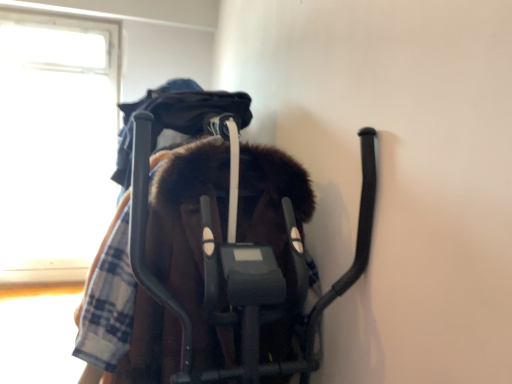
Measure the distance between point (217, 185) and camera.

The depth of point (217, 185) is 1.26 meters.

This screenshot has height=384, width=512. What do you see at coordinates (191, 241) in the screenshot? I see `brown fuzzy coat at center` at bounding box center [191, 241].

Image resolution: width=512 pixels, height=384 pixels. I want to click on brown fuzzy coat at center, so click(x=191, y=241).

Measure the distance between brown fuzzy coat at center and camera.

A distance of 1.09 meters exists between brown fuzzy coat at center and camera.

What do you see at coordinates (55, 142) in the screenshot?
I see `transparent glass window at upper left` at bounding box center [55, 142].

Identify the location of transparent glass window at upper left. (55, 142).

The height and width of the screenshot is (384, 512). In order to click on brown fuzzy coat at center in this screenshot , I will do `click(191, 241)`.

Between transparent glass window at upper left and brown fuzzy coat at center, which one appears on the left side from the viewer's perspective?

transparent glass window at upper left is more to the left.

Which object is closer to the camera, transparent glass window at upper left or brown fuzzy coat at center?

Positioned in front is brown fuzzy coat at center.

Does point (38, 237) appear closer or farther from the camera than point (167, 379)?

Point (38, 237) appears to be farther away from the viewer than point (167, 379).

From the image's perspective, which is above, transparent glass window at upper left or brown fuzzy coat at center?

transparent glass window at upper left, from the image's perspective.

From a real-world perspective, is transparent glass window at upper left positioned above or below brown fuzzy coat at center?

In terms of real-world spatial position, transparent glass window at upper left is above brown fuzzy coat at center.

Based on the photo, does transparent glass window at upper left have a greater width compared to brown fuzzy coat at center?

No.

Can you confirm if transparent glass window at upper left is shorter than brown fuzzy coat at center?

Incorrect, the height of transparent glass window at upper left does not fall short of that of brown fuzzy coat at center.

Looking at the image, does transparent glass window at upper left seem bigger or smaller compared to brown fuzzy coat at center?

transparent glass window at upper left is smaller than brown fuzzy coat at center.

Is brown fuzzy coat at center surrounded by transparent glass window at upper left?

No, transparent glass window at upper left does not contain brown fuzzy coat at center.

Is transparent glass window at upper left not near brown fuzzy coat at center?

transparent glass window at upper left is far away from brown fuzzy coat at center.

Is transparent glass window at upper left turned away from brown fuzzy coat at center?

transparent glass window at upper left does not have its back to brown fuzzy coat at center.

How much distance is there between transparent glass window at upper left and brown fuzzy coat at center?

transparent glass window at upper left and brown fuzzy coat at center are 2.55 meters apart from each other.

Find the location of a particular element. The width and height of the screenshot is (512, 384). baby elephant directly beneath the transparent glass window at upper left (from a real-world perspective) is located at coordinates (191, 241).

Which is more to the right, brown fuzzy coat at center or transparent glass window at upper left?

brown fuzzy coat at center.

Considering their positions, is brown fuzzy coat at center located in front of or behind transparent glass window at upper left?

A: In the image, brown fuzzy coat at center appears in front of transparent glass window at upper left.

Which point is more distant from viewer, (200, 193) or (52, 125)?

The point (52, 125) is farther.

From the image's perspective, is brown fuzzy coat at center positioned above or below transparent glass window at upper left?

Clearly, from the image's perspective, brown fuzzy coat at center is below transparent glass window at upper left.

From a real-world perspective, which object stands above the other?

transparent glass window at upper left is physically above.

Considering the relative sizes of brown fuzzy coat at center and transparent glass window at upper left in the image provided, is brown fuzzy coat at center thinner than transparent glass window at upper left?

No, brown fuzzy coat at center is not thinner than transparent glass window at upper left.

From the picture: From their relative heights in the image, would you say brown fuzzy coat at center is taller or shorter than transparent glass window at upper left?

In the image, brown fuzzy coat at center appears to be shorter than transparent glass window at upper left.

Considering the sizes of objects brown fuzzy coat at center and transparent glass window at upper left in the image provided, who is smaller, brown fuzzy coat at center or transparent glass window at upper left?

transparent glass window at upper left is smaller.

Would you say brown fuzzy coat at center contains transparent glass window at upper left?

No, transparent glass window at upper left is not inside brown fuzzy coat at center.

Are brown fuzzy coat at center and transparent glass window at upper left beside each other?

No, brown fuzzy coat at center is not beside transparent glass window at upper left.

From the picture: Is brown fuzzy coat at center facing towards transparent glass window at upper left?

No, brown fuzzy coat at center is not turned towards transparent glass window at upper left.

What's the angular difference between brown fuzzy coat at center and transparent glass window at upper left's facing directions?

91.1 degrees.

Locate an element on the screen. This screenshot has width=512, height=384. baby elephant that appears below the transparent glass window at upper left (from a real-world perspective) is located at coordinates 191,241.

Locate an element on the screen. This screenshot has width=512, height=384. baby elephant that is on the right side of transparent glass window at upper left is located at coordinates (191, 241).

This screenshot has width=512, height=384. Find the location of `window above the brown fuzzy coat at center (from a real-world perspective)`. window above the brown fuzzy coat at center (from a real-world perspective) is located at coordinates (55, 142).